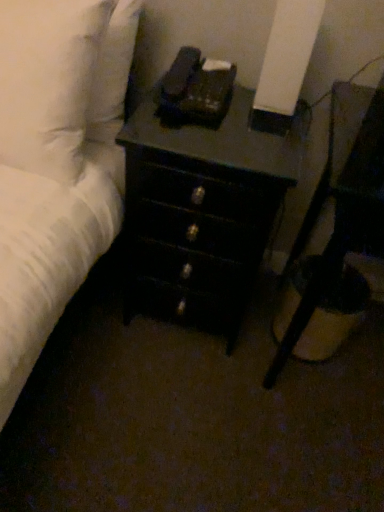
Question: Which is correct: white soft pillow at upper left is inside black wood chest of drawers at center, or outside of it?

Choices:
 (A) outside
 (B) inside

Answer: (A)

Question: In the image, is white soft pillow at upper left positioned in front of or behind black wood chest of drawers at center?

Choices:
 (A) front
 (B) behind

Answer: (A)

Question: Which of these objects is positioned closest to the black wood chest of drawers at center?

Choices:
 (A) white soft pillow at upper left
 (B) black glossy nightstand at lower right

Answer: (B)

Question: Which object is positioned closest to the black glossy nightstand at lower right?

Choices:
 (A) black wood chest of drawers at center
 (B) white soft pillow at upper left

Answer: (A)